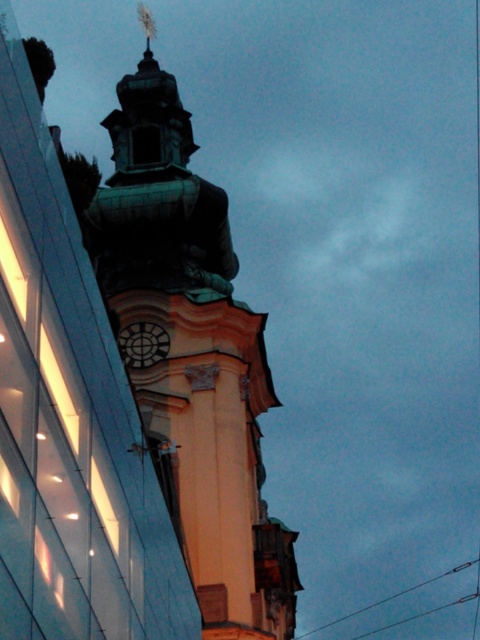
Question: Which point is closer to the camera?

Choices:
 (A) green patina tower at center
 (B) matte black clock at center

Answer: (A)

Question: Which of the following is the farthest from the observer?

Choices:
 (A) (249, 360)
 (B) (168, 340)

Answer: (A)

Question: Where is green patina tower at center located in relation to matte black clock at center in the image?

Choices:
 (A) right
 (B) left

Answer: (A)

Question: Is green patina tower at center bigger than matte black clock at center?

Choices:
 (A) no
 (B) yes

Answer: (B)

Question: Does green patina tower at center appear under matte black clock at center?

Choices:
 (A) no
 (B) yes

Answer: (A)